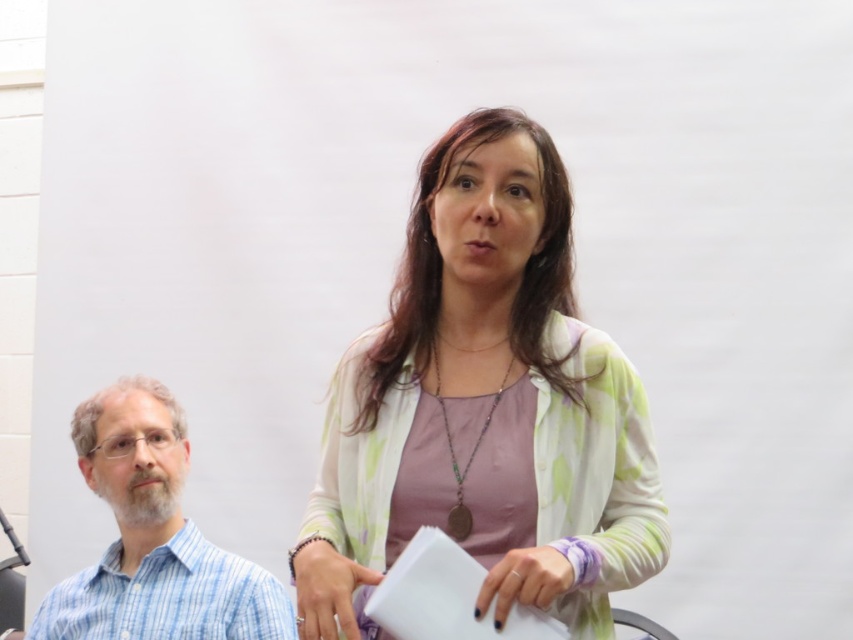
You are a tailor measuring the distance between two clothing items in a photo. The scene shows a woman wearing a pastel floral cardigan at center and a man in a blue striped shirt at left. The tailor needs to ensure there is enough space between them for a 30 inch measuring tape. Can the tailor comfortably fit the tape between them?

The pastel floral cardigan at center and blue striped shirt at left are 32.31 inches apart, which is more than enough space for the 30 inch measuring tape. The tailor can comfortably fit the tape between them.

You are an observer sitting in the back of the room. You notice two people wearing the pastel floral cardigan at center and the blue striped shirt at left. Based on their positions, which clothing item is higher up in your field of view?

The pastel floral cardigan at center is above the blue striped shirt at left, so the pastel floral cardigan at center is higher up in your field of view.

You are standing in the room and want to place a small plant exactly at the location marked by the point (485, 406). Which object from the scene is already at that point?

The pastel floral cardigan at center is located at point (485, 406).